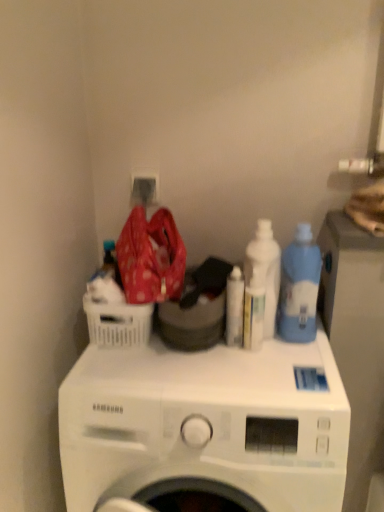
The image size is (384, 512). In order to click on free space in front of white plastic basket at left in this screenshot , I will do 138,382.